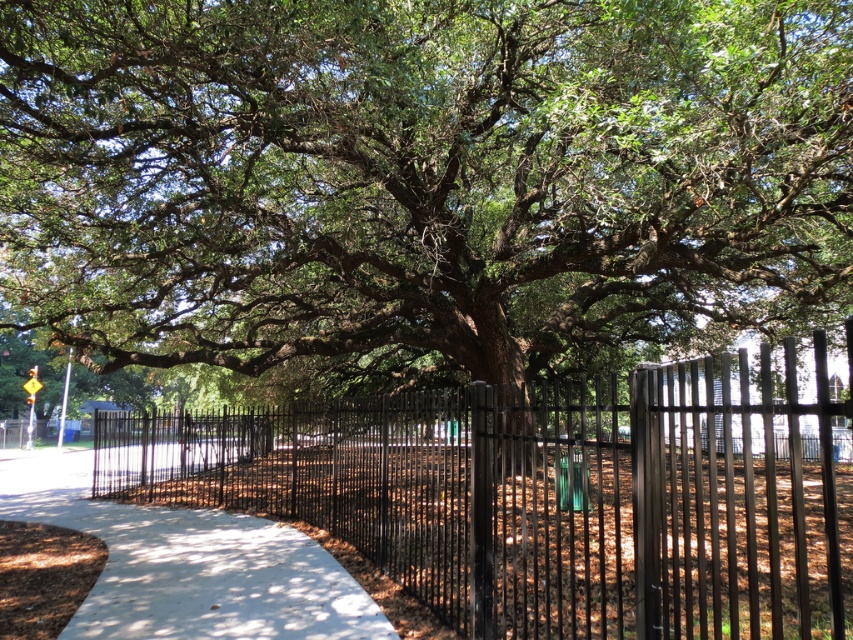
Does green leafy tree at center have a greater height compared to white concrete pavement at center?

Yes, green leafy tree at center is taller than white concrete pavement at center.

Who is lower down, green leafy tree at center or white concrete pavement at center?

white concrete pavement at center is below.

The image size is (853, 640). I want to click on green leafy tree at center, so click(422, 180).

Identify the location of green leafy tree at center. (422, 180).

Which of these two, black metal fence at center or white concrete pavement at center, stands taller?

Standing taller between the two is black metal fence at center.

Measure the distance between point (666, 556) and camera.

Point (666, 556) and camera are 3.16 meters apart from each other.

The image size is (853, 640). Identify the location of black metal fence at center. (547, 496).

Is point (543, 163) positioned behind point (799, 460)?

Yes.

Which of these two, green leafy tree at center or black metal fence at center, stands shorter?

With less height is black metal fence at center.

The width and height of the screenshot is (853, 640). What are the coordinates of `green leafy tree at center` in the screenshot? It's located at (422, 180).